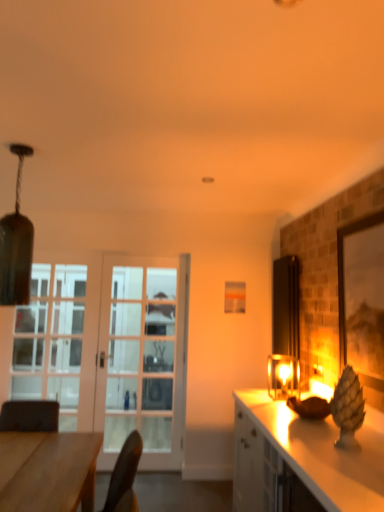
Find the location of a particular element. The height and width of the screenshot is (512, 384). white glass door at left is located at coordinates (111, 351).

The width and height of the screenshot is (384, 512). I want to click on matte glass lampshade at upper left, so click(x=16, y=245).

Measure the distance between white glossy cabinet at right and camera.

A distance of 6.30 feet exists between white glossy cabinet at right and camera.

The height and width of the screenshot is (512, 384). Describe the element at coordinates (362, 303) in the screenshot. I see `matte wooden picture frame at right` at that location.

Find the location of a particular element. The height and width of the screenshot is (512, 384). wooden desk at lower left is located at coordinates (48, 471).

You are a GUI agent. You are given a task and a screenshot of the screen. Output one action in this format:
    pyautogui.click(x=<x>, y=<y>)
    Task: Click on the white glass door at left
    The image size is (384, 512).
    Given the screenshot: What is the action you would take?
    pyautogui.click(x=111, y=351)

Would you say white glossy cabinet at right is outside matte glass lampshade at right?

Absolutely, white glossy cabinet at right is external to matte glass lampshade at right.

Can you confirm if white glossy cabinet at right is shorter than matte glass lampshade at right?

No.

Is white glossy cabinet at right with matte glass lampshade at right?

white glossy cabinet at right is not next to matte glass lampshade at right, and they're not touching.

From a real-world perspective, is matte wooden picture frame at right positioned under white glass door at left based on gravity?

No, from a real-world perspective, matte wooden picture frame at right is not under white glass door at left.

Is matte wooden picture frame at right oriented away from white glass door at left?

No, matte wooden picture frame at right's orientation is not away from white glass door at left.

Considering the relative positions of matte wooden picture frame at right and white glass door at left in the image provided, is matte wooden picture frame at right behind white glass door at left?

No, it is not.

Is point (20, 168) more distant than point (42, 457)?

Yes.

From the picture: Is matte glass lampshade at upper left at the left side of wooden desk at lower left?

Correct, you'll find matte glass lampshade at upper left to the left of wooden desk at lower left.

From the picture: Between matte glass lampshade at upper left and wooden desk at lower left, which one has more height?

matte glass lampshade at upper left.

From the image's perspective, does matte glass lampshade at upper left appear lower than wooden desk at lower left?

Answer: Actually, matte glass lampshade at upper left appears above wooden desk at lower left in the image.

Between clear glass door at left and matte glass lampshade at right, which one has smaller size?

matte glass lampshade at right.

Which object is closer to the camera, clear glass door at left or matte glass lampshade at right?

matte glass lampshade at right.

In the scene shown: Can you tell me how much clear glass door at left and matte glass lampshade at right differ in facing direction?

There is a 89.6-degree angle between the facing directions of clear glass door at left and matte glass lampshade at right.

Considering the positions of point (50, 438) and point (377, 225), is point (50, 438) closer or farther from the camera than point (377, 225)?

Point (50, 438) appears to be farther away from the viewer than point (377, 225).

Which is more to the left, wooden desk at lower left or matte wooden picture frame at right?

Positioned to the left is wooden desk at lower left.

From the image's perspective, is wooden desk at lower left located above matte wooden picture frame at right?

No, from the image's perspective, wooden desk at lower left is not over matte wooden picture frame at right.

Would you say wooden desk at lower left contains matte wooden picture frame at right?

No, matte wooden picture frame at right is not inside wooden desk at lower left.

Which of these two, matte glass lampshade at right or wooden desk at lower left, is wider?

wooden desk at lower left is wider.

Based on the photo, is matte glass lampshade at right turned away from wooden desk at lower left?

No, matte glass lampshade at right is not facing the opposite direction of wooden desk at lower left.

From the image's perspective, which one is positioned higher, matte glass lampshade at right or wooden desk at lower left?

matte glass lampshade at right is shown above in the image.

Is matte glass lampshade at right next to wooden desk at lower left?

matte glass lampshade at right and wooden desk at lower left are clearly separated.

From a real-world perspective, does white glass door at left stand above matte wooden picture frame at right?

Actually, white glass door at left is physically below matte wooden picture frame at right in the real world.

Is white glass door at left bigger or smaller than matte wooden picture frame at right?

In the image, white glass door at left appears to be larger than matte wooden picture frame at right.

Is matte wooden picture frame at right at the back of white glass door at left?

No, white glass door at left is not facing the opposite direction of matte wooden picture frame at right.

Is white glass door at left at the left side of matte wooden picture frame at right?

Yes, white glass door at left is to the left of matte wooden picture frame at right.

At what (x,y) coordinates should I click in order to perform the action: click on cabinetry lying below the matte glass lampshade at right (from the image's perspective). Please return your answer as a coordinate pair (x, y). Looking at the image, I should click on (264, 474).

You are a GUI agent. You are given a task and a screenshot of the screen. Output one action in this format:
    pyautogui.click(x=<x>, y=<y>)
    Task: Click on the door to the left of matte wooden picture frame at right
    
    Given the screenshot: What is the action you would take?
    pyautogui.click(x=111, y=351)

Looking at the image, which one is located closer to matte glass lampshade at upper left, matte glass lampshade at right or white glass door at left?

white glass door at left is closer to matte glass lampshade at upper left.

Looking at the image, which one is located closer to matte glass lampshade at right, matte wooden picture frame at right or white glossy cabinet at right?

white glossy cabinet at right.

Looking at the image, which one is located closer to wooden desk at lower left, white glass door at left or clear glass door at left?

white glass door at left is closer to wooden desk at lower left.

Which object lies nearer to the anchor point matte wooden picture frame at right, clear glass door at left or wooden desk at lower left?

wooden desk at lower left is closer to matte wooden picture frame at right.

Which object lies nearer to the anchor point matte wooden picture frame at right, wooden desk at lower left or white glossy cabinet at right?

white glossy cabinet at right lies closer to matte wooden picture frame at right than the other object.

Looking at the image, which one is located closer to clear glass door at left, white glossy cabinet at right or matte glass lampshade at right?

white glossy cabinet at right is closer to clear glass door at left.

Based on their spatial positions, is white glass door at left or white glossy cabinet at right further from clear glass door at left?

The object further to clear glass door at left is white glossy cabinet at right.

Looking at this image, looking at the image, which one is located closer to matte wooden picture frame at right, matte glass lampshade at upper left or white glossy cabinet at right?

white glossy cabinet at right.

Find the location of a particular element. The image size is (384, 512). door situated between matte glass lampshade at upper left and matte wooden picture frame at right from left to right is located at coordinates (111, 351).

This screenshot has height=512, width=384. Identify the location of cabinetry between matte glass lampshade at upper left and matte wooden picture frame at right in the horizontal direction. (264, 474).

This screenshot has height=512, width=384. I want to click on cabinetry positioned between wooden desk at lower left and clear glass door at left from near to far, so click(x=264, y=474).

The height and width of the screenshot is (512, 384). In order to click on light fixture positioned between wooden desk at lower left and white glass door at left from near to far in this screenshot , I will do `click(283, 375)`.